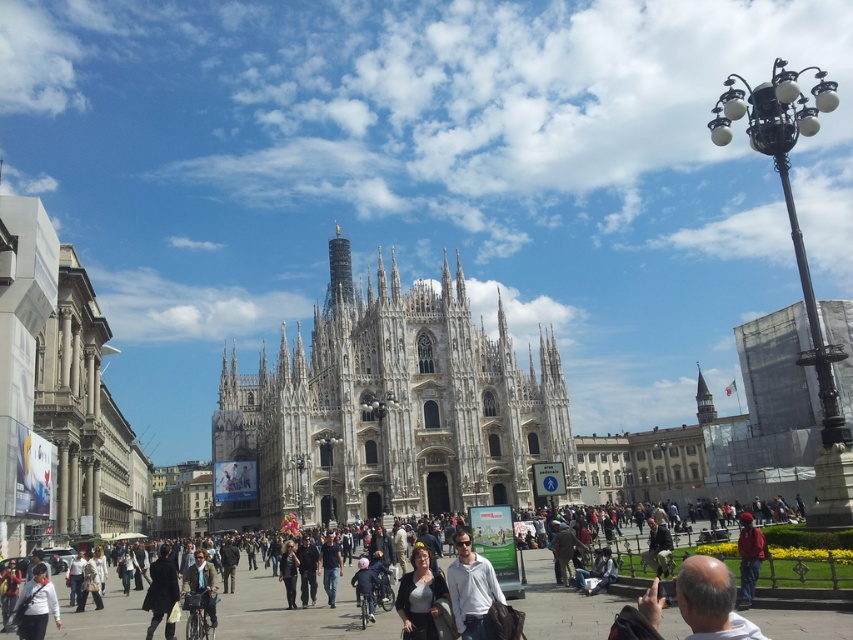
You are a photographer planning to capture a shot of the cathedral with the two jackets in the frame. Given that the white matte jacket at center is narrower than the red fabric jacket at lower right, which jacket would you adjust to ensure both are fully visible in your photo?

Since the white matte jacket at center is narrower than the red fabric jacket at lower right, you should adjust the framing to accommodate the wider red fabric jacket at lower right to ensure both are fully visible.

You are a photographer trying to capture a clear shot of the cathedral. You notice two people in the foreground wearing a white matte jacket at center and a matte black jacket at center. Based on their jackets, which person might you ask to move aside first to ensure your photo isn t blocked?

The white matte jacket at center might be wider than the matte black jacket at center, so the person wearing the white matte jacket at center might block the view more and should be asked to move first.